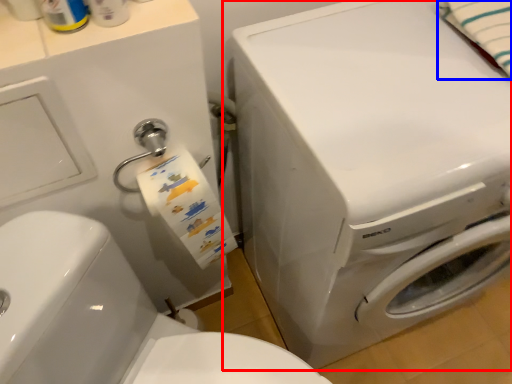
Question: Which of the following is the farthest to the observer, washing machine (highlighted by a red box) or bath towel (highlighted by a blue box)?

Choices:
 (A) washing machine
 (B) bath towel

Answer: (B)